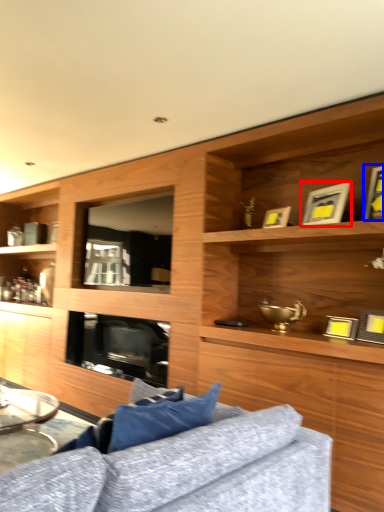
Question: Which of the following is the closest to the observer, picture frame (highlighted by a red box) or picture frame (highlighted by a blue box)?

Choices:
 (A) picture frame
 (B) picture frame

Answer: (B)